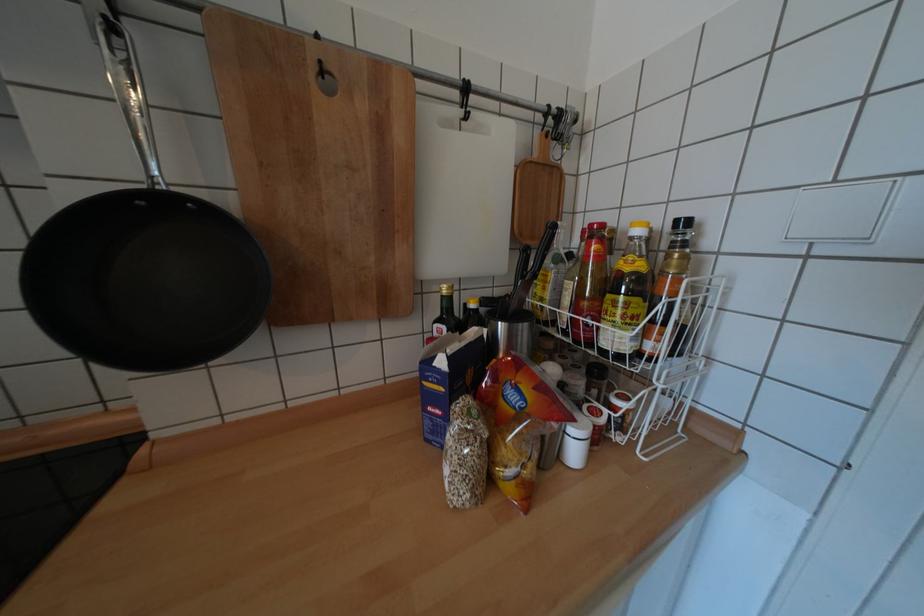
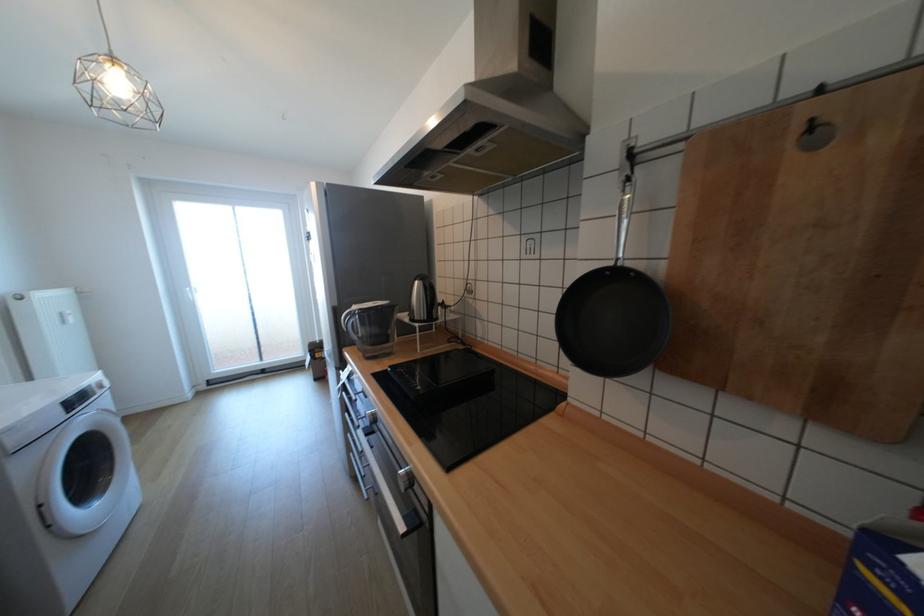
Question: How did the camera likely rotate?

Choices:
 (A) Left
 (B) Right
 (C) Up
 (D) Down

Answer: (A)